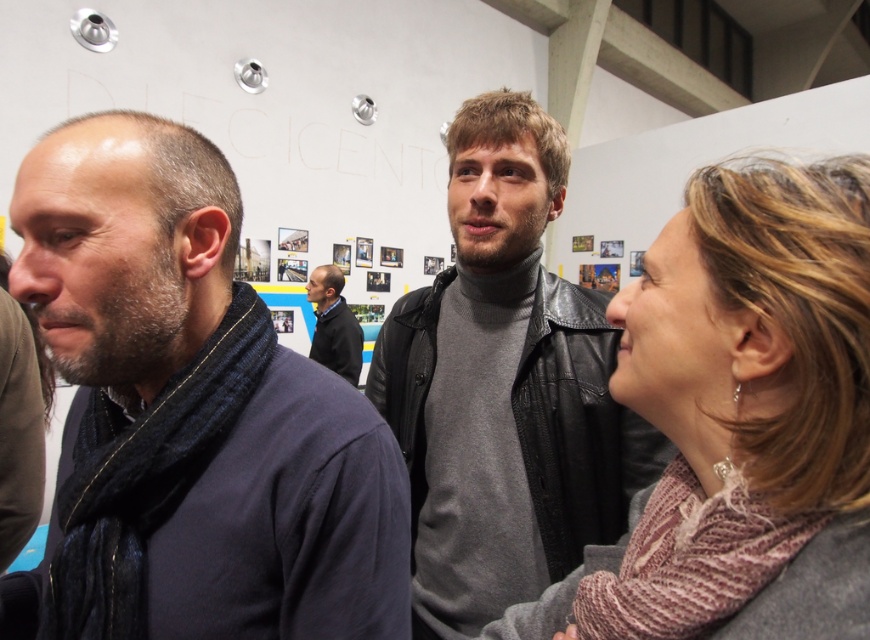
Question: Does leather jacket at center have a lesser width compared to dark gray sweater at center?

Choices:
 (A) no
 (B) yes

Answer: (A)

Question: Which point is farther to the camera?

Choices:
 (A) (489, 544)
 (B) (840, 396)
 (C) (218, 552)
 (D) (316, 333)

Answer: (D)

Question: Which point is closer to the camera?

Choices:
 (A) (339, 339)
 (B) (125, 236)
 (C) (703, 205)

Answer: (C)

Question: Does knitted pink sweater at center have a smaller size compared to dark gray sweater at center?

Choices:
 (A) no
 (B) yes

Answer: (B)

Question: Which of these objects is positioned farthest from the dark blue scarf at left?

Choices:
 (A) knitted pink sweater at center
 (B) dark gray sweater at center
 (C) leather jacket at center

Answer: (B)

Question: Is dark blue scarf at left below leather jacket at center?

Choices:
 (A) yes
 (B) no

Answer: (A)